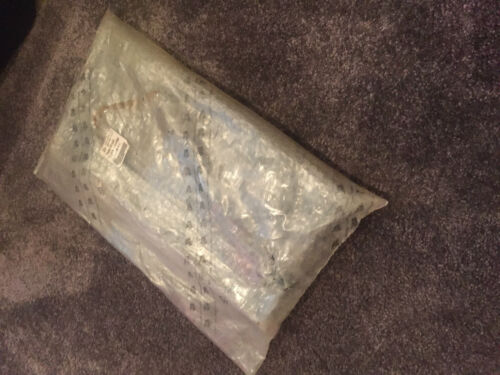
The image size is (500, 375). Identify the location of carpet above package. (303, 73).